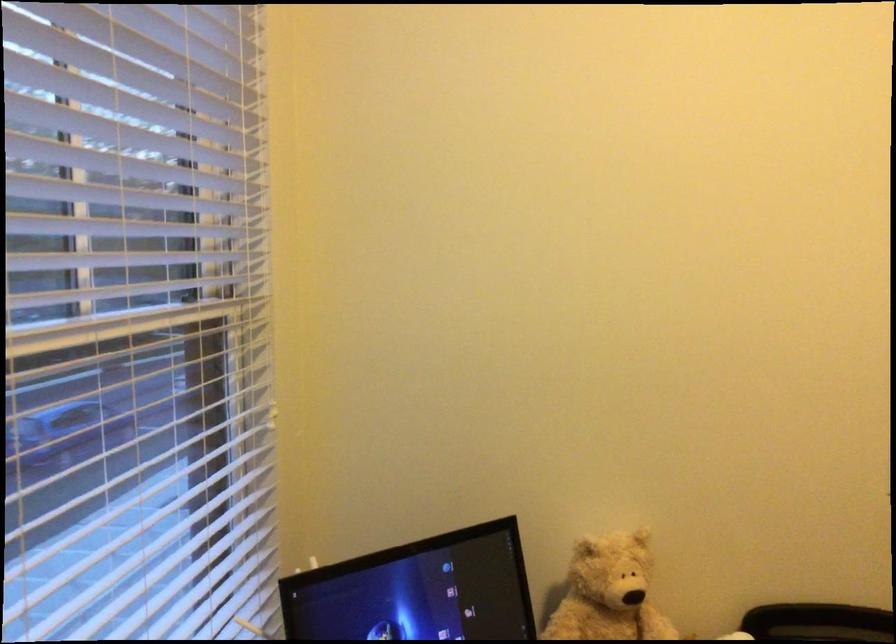
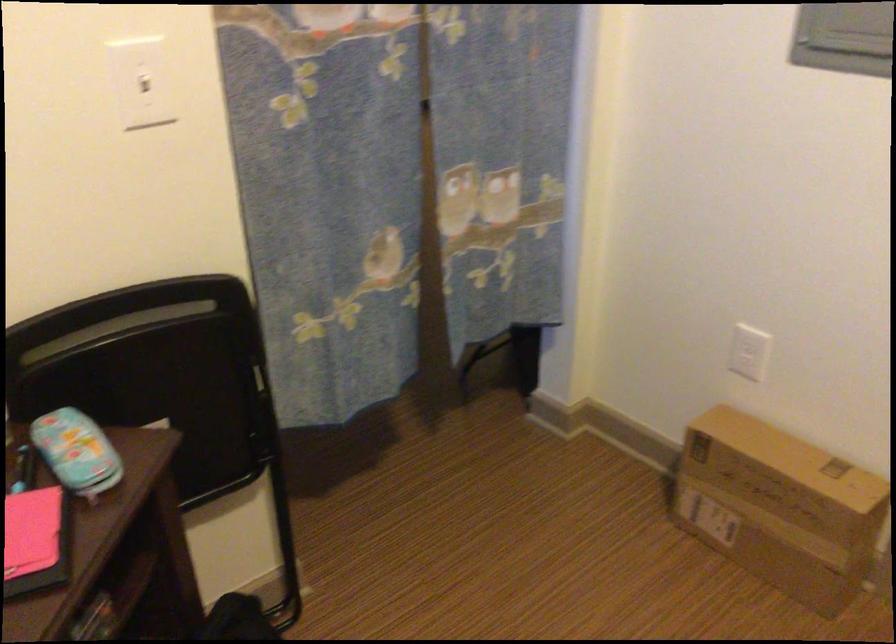
How did the camera likely rotate?

The rotation direction of the camera is right-down.